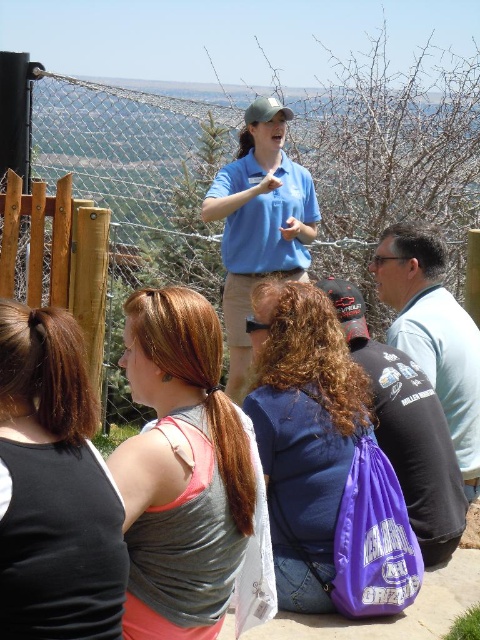
Question: Based on their relative distances, which object is farther from the blue cotton shirt at center?

Choices:
 (A) light blue shirt at center
 (B) purple fabric backpack at center

Answer: (B)

Question: Which point is farther to the camera?

Choices:
 (A) black fabric tank top at lower left
 (B) light blue shirt at center
 (C) purple fabric bag at center
 (D) blue cotton shirt at center

Answer: (D)

Question: Does matte gray tank top at center appear on the left side of purple fabric bag at center?

Choices:
 (A) no
 (B) yes

Answer: (B)

Question: Which object is the closest to the light blue shirt at center?

Choices:
 (A) matte gray tank top at center
 (B) purple fabric backpack at center
 (C) purple fabric bag at center

Answer: (C)

Question: Observing the image, what is the correct spatial positioning of black fabric tank top at lower left in reference to purple fabric backpack at center?

Choices:
 (A) below
 (B) above

Answer: (B)

Question: In this image, where is matte gray tank top at center located relative to light blue shirt at center?

Choices:
 (A) right
 (B) left

Answer: (B)